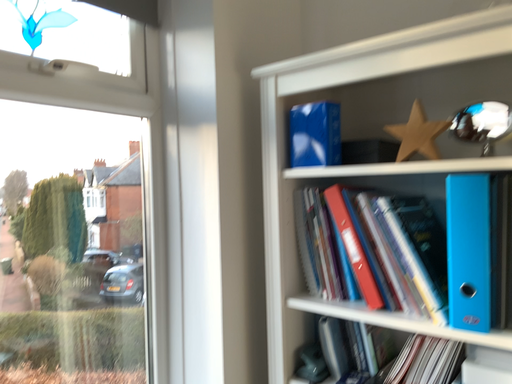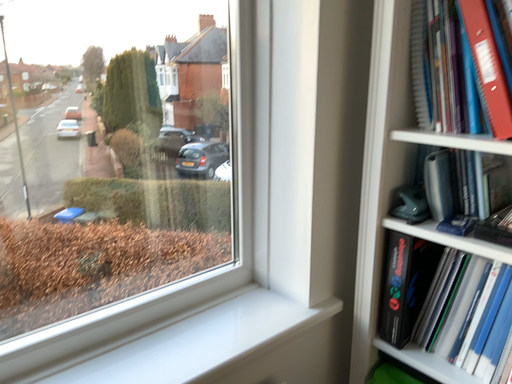
Question: How did the camera likely rotate when shooting the video?

Choices:
 (A) rotated downward
 (B) rotated upward

Answer: (A)